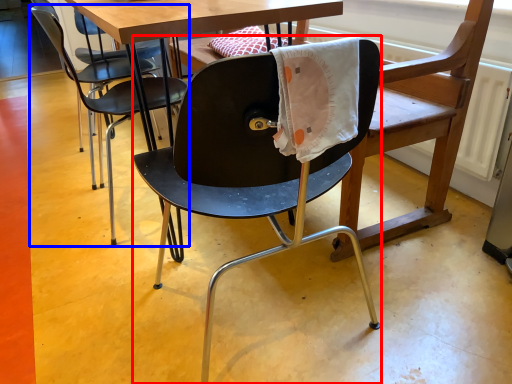
Question: Among these objects, which one is nearest to the camera, chair (highlighted by a red box) or chair (highlighted by a blue box)?

Choices:
 (A) chair
 (B) chair

Answer: (A)